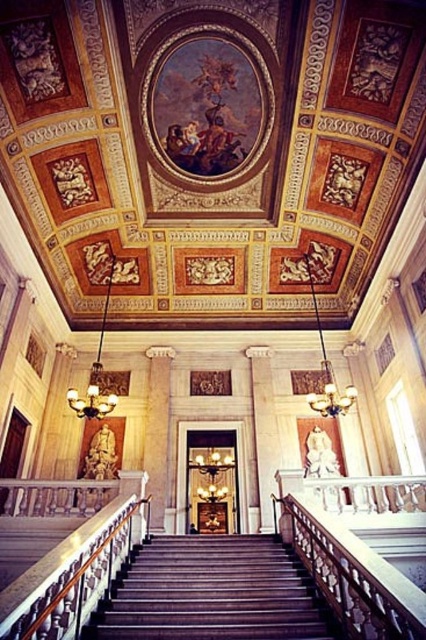
Question: Based on their relative distances, which object is nearer to the white marble railing at center?

Choices:
 (A) white marble column at center
 (B) wooden staircase at center

Answer: (B)

Question: Estimate the real-world distances between objects in this image. Which object is closer to the wooden staircase at center?

Choices:
 (A) white marble railing at center
 (B) white marble column at center

Answer: (A)

Question: Is white marble railing at center thinner than white marble column at center?

Choices:
 (A) yes
 (B) no

Answer: (A)

Question: Which point is farther to the camera?

Choices:
 (A) (146, 349)
 (B) (150, 592)

Answer: (A)

Question: Is white marble railing at center to the left of white marble column at center from the viewer's perspective?

Choices:
 (A) no
 (B) yes

Answer: (B)

Question: Is wooden staircase at center wider than white marble railing at center?

Choices:
 (A) no
 (B) yes

Answer: (A)